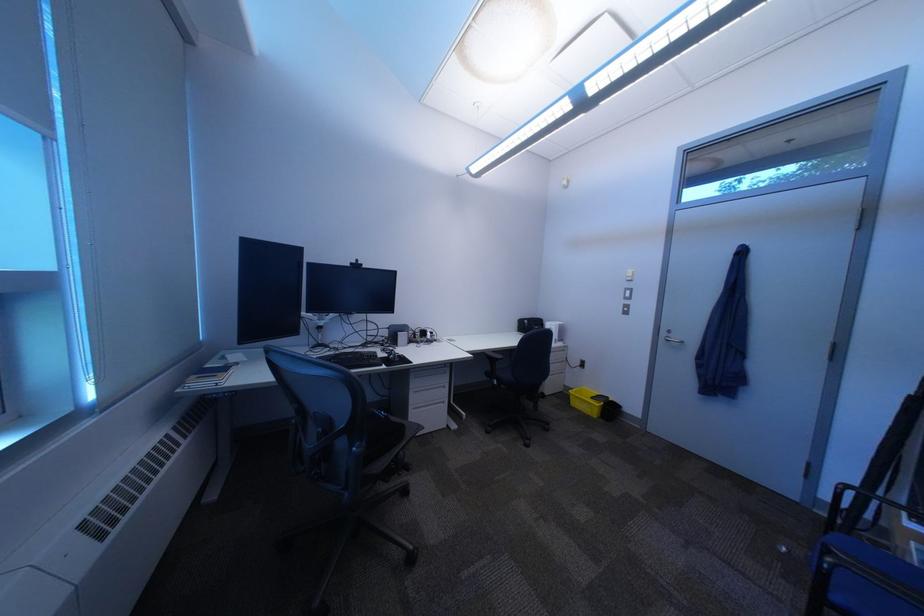
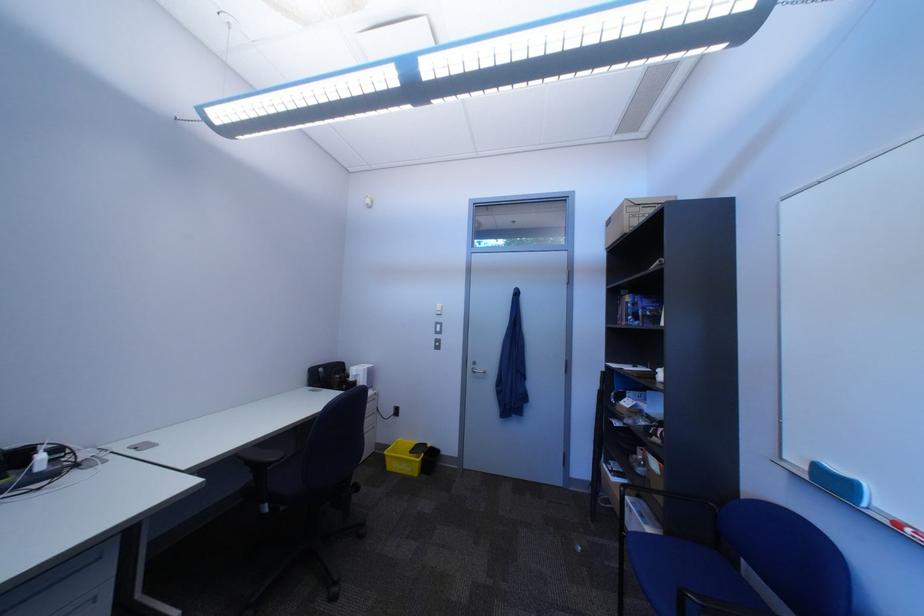
The point at (857, 488) is marked in the first image. Where is the corresponding point in the second image?

(638, 491)